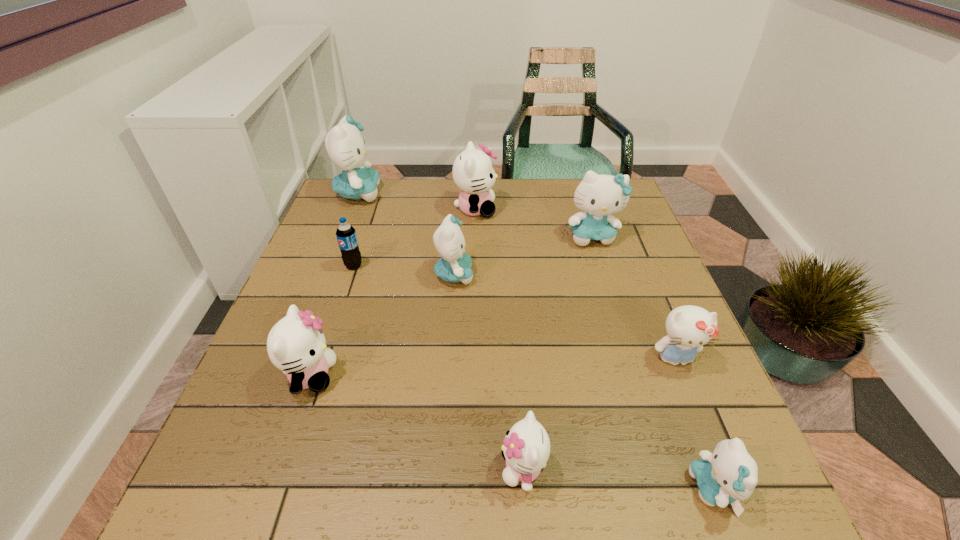
Where is `the nearest blue kitten`? This screenshot has height=540, width=960. the nearest blue kitten is located at coordinates (729, 475).

You are a GUI agent. You are given a task and a screenshot of the screen. Output one action in this format:
    pyautogui.click(x=<x>, y=<y>)
    Task: Click on the free space located on the face of the leftmost blue kitten
    This screenshot has height=540, width=960.
    Given the screenshot: What is the action you would take?
    pyautogui.click(x=497, y=193)

Where is `vacant region located 0.330m on the front-facing side of the farthest white kitten`? The image size is (960, 540). vacant region located 0.330m on the front-facing side of the farthest white kitten is located at coordinates (608, 209).

I want to click on vacant space situated 0.330m on the face of the second farthest blue kitten, so click(x=627, y=348).

Where is `free space located 0.240m on the face of the third farthest blue kitten`? Image resolution: width=960 pixels, height=540 pixels. free space located 0.240m on the face of the third farthest blue kitten is located at coordinates (570, 275).

In order to click on blank space located 0.090m on the front-facing side of the second nearest white kitten in this screenshot , I will do `click(382, 375)`.

You are a GUI agent. You are given a task and a screenshot of the screen. Output one action in this format:
    pyautogui.click(x=<x>, y=<y>)
    Task: Click on the free space located 0.120m on the front of the soda bottle
    This screenshot has height=540, width=960.
    Given the screenshot: What is the action you would take?
    pyautogui.click(x=341, y=307)

The height and width of the screenshot is (540, 960). I want to click on blank space located on the front-facing side of the nearest white kitten, so click(x=302, y=468).

Find the location of a particular element. The width and height of the screenshot is (960, 540). free spot located 0.230m on the front-facing side of the nearest white kitten is located at coordinates (362, 468).

The height and width of the screenshot is (540, 960). What are the coordinates of `vacant space located on the front-facing side of the nearest white kitten` in the screenshot? It's located at (284, 468).